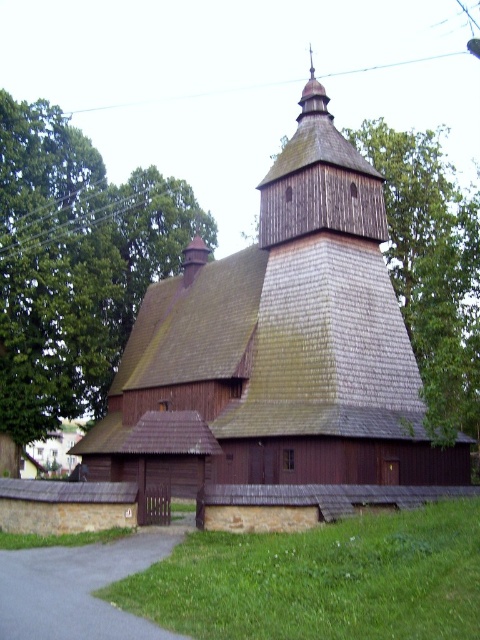
Does brown wooden church at center have a smaller size compared to brown wooden tree at upper left?

No.

Who is positioned more to the right, brown wooden church at center or brown wooden tree at upper left?

Positioned to the right is brown wooden church at center.

Between point (348, 468) and point (63, 358), which one is positioned in front?

Positioned in front is point (348, 468).

Locate an element on the screen. The height and width of the screenshot is (640, 480). brown wooden church at center is located at coordinates (280, 360).